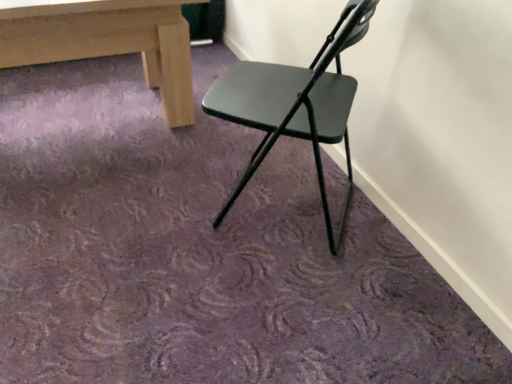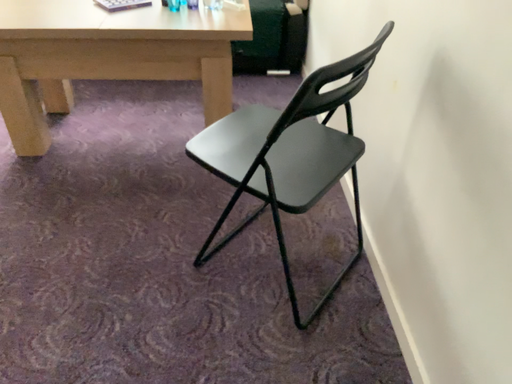
Question: How did the camera likely rotate when shooting the video?

Choices:
 (A) rotated right
 (B) rotated left

Answer: (B)